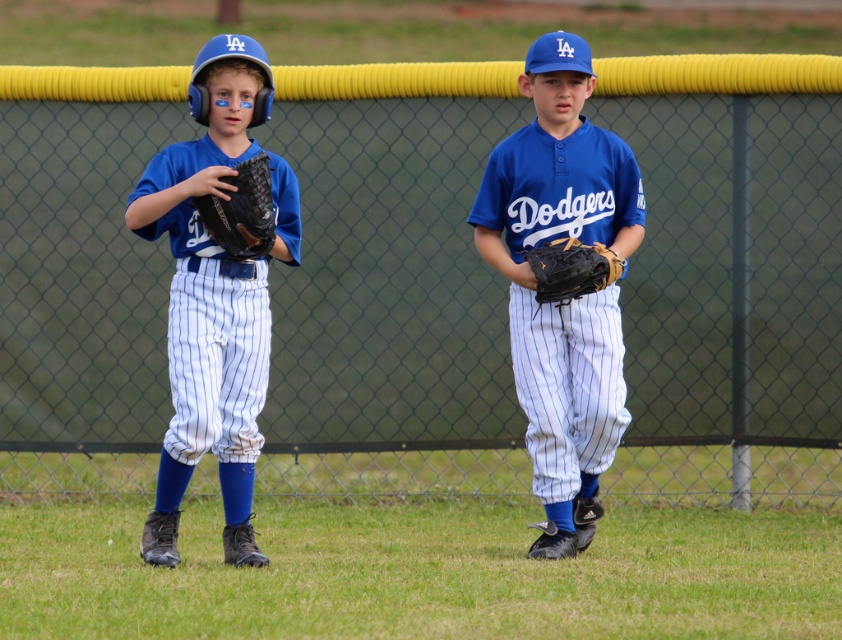
Describe the element at coordinates (216, 292) in the screenshot. This screenshot has height=640, width=842. I see `matte blue baseball glove at left` at that location.

Can you confirm if matte blue baseball glove at left is positioned below black leather glove at center?

Yes.

Find the location of a particular element. matte blue baseball glove at left is located at coordinates (216, 292).

How much distance is there between yellow rubberized fence at center and black leather glove at center?

A distance of 6.92 feet exists between yellow rubberized fence at center and black leather glove at center.

Does yellow rubberized fence at center lie in front of black leather glove at center?

No, it is not.

Is point (9, 188) positioned before point (557, 259)?

No, it is behind (557, 259).

Locate an element on the screen. This screenshot has width=842, height=640. yellow rubberized fence at center is located at coordinates (390, 288).

Looking at this image, is matte blue jersey at center smaller than matte blue baseball glove at left?

No, matte blue jersey at center is not smaller than matte blue baseball glove at left.

Who is more distant from viewer, (541,451) or (206,260)?

Point (541,451)

Identify the location of matte blue jersey at center. The image size is (842, 640). (563, 282).